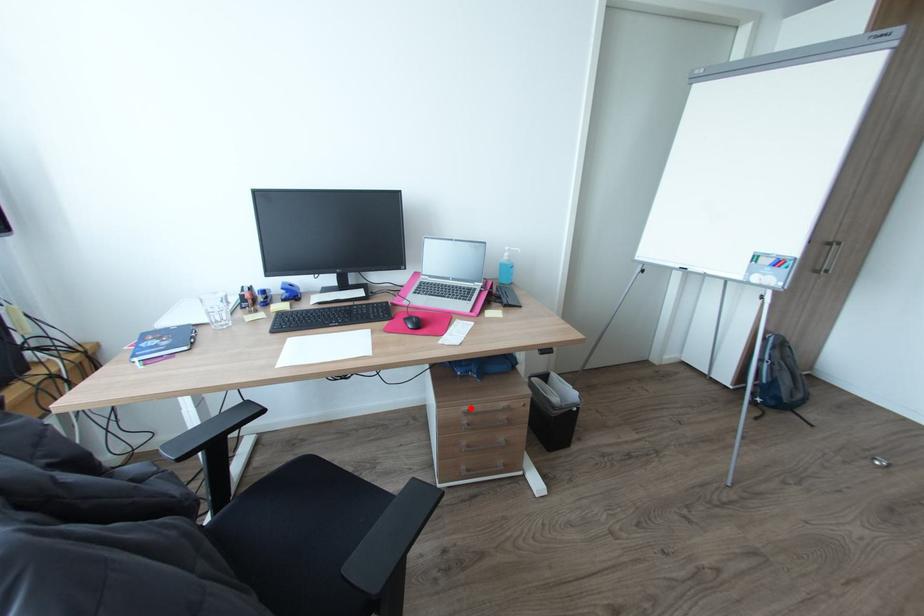
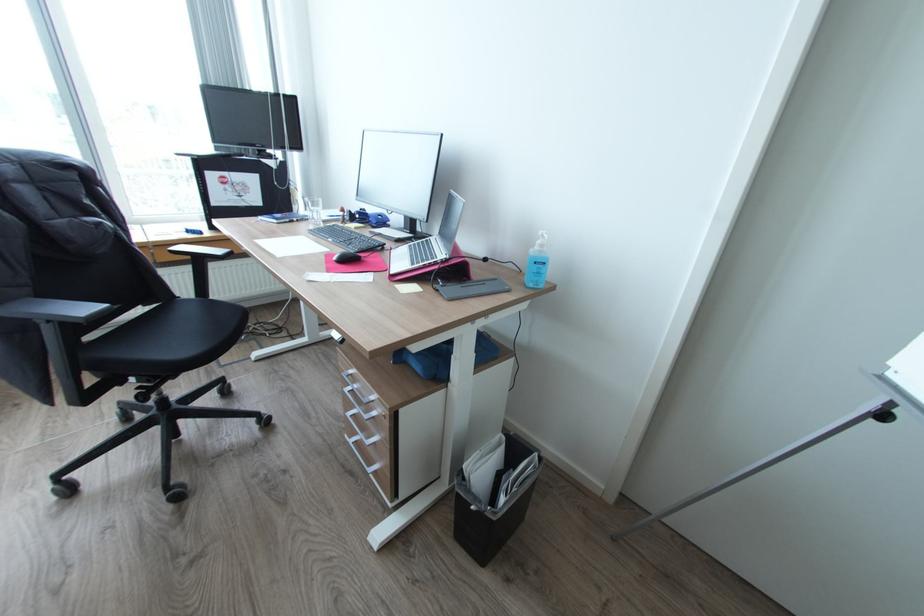
Question: I am providing you with two images of the same scene from different viewpoints. A red point is shown in image1. For the corresponding object point in image2, is it positioned nearer or farther from the camera?

Choices:
 (A) Nearer
 (B) Farther

Answer: (B)